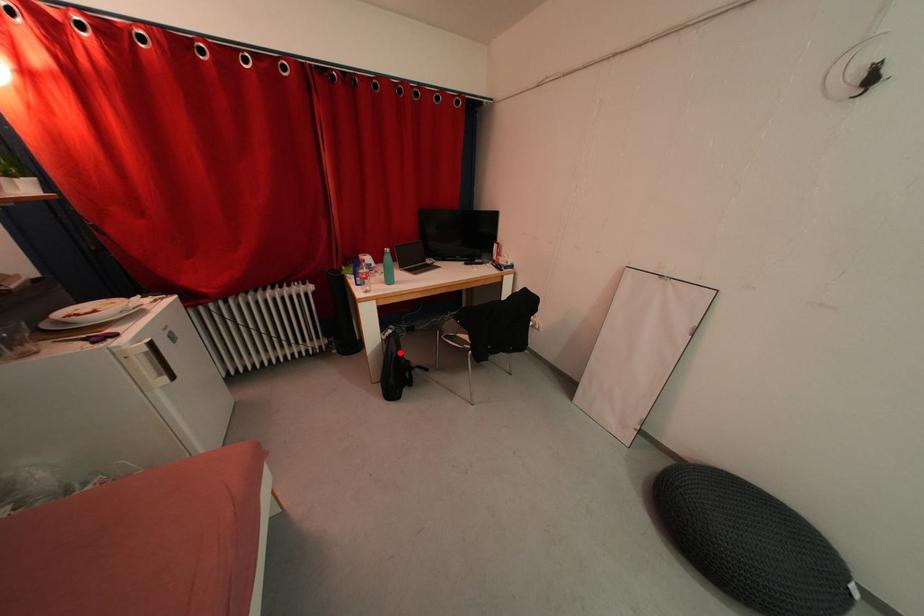
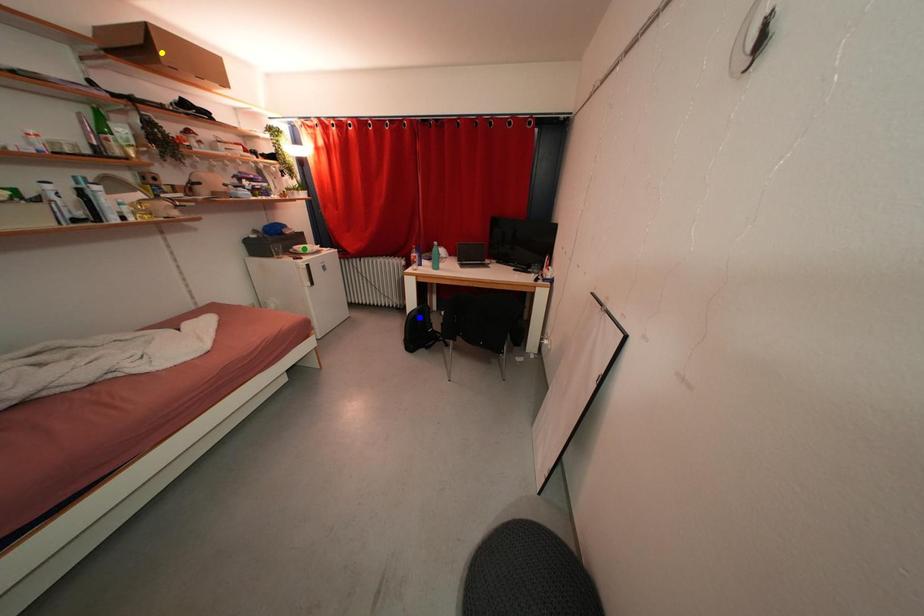
Question: I am providing you with two images of the same scene from different viewpoints. A red point is marked on the first image. You are given multiple points on the second image. In image 2, which mark is for the same physical point as the one in image 1?

Choices:
 (A) blue point
 (B) yellow point
 (C) green point

Answer: (A)